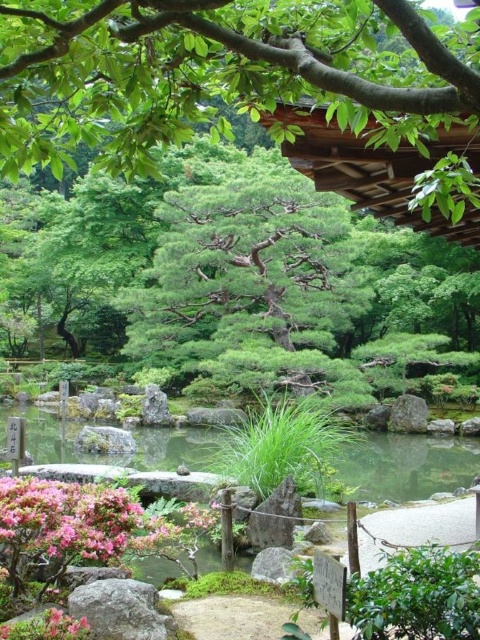
Question: Can you confirm if green stone pond at center is thinner than gray smooth rock at center-right?

Choices:
 (A) no
 (B) yes

Answer: (A)

Question: Which point is farther from the camera taking this photo?

Choices:
 (A) click(x=126, y=513)
 (B) click(x=347, y=468)

Answer: (B)

Question: Which point appears farthest from the camera in this image?

Choices:
 (A) (384, 477)
 (B) (43, 529)

Answer: (A)

Question: Does pink matte flowers at lower left lie in front of gray rough rock at lower left?

Choices:
 (A) yes
 (B) no

Answer: (B)

Question: Which is farther from the gray smooth rock at center-right?

Choices:
 (A) pink matte flowers at lower left
 (B) green stone pond at center
 (C) green leafy tree at upper center

Answer: (A)

Question: Does pink matte flowers at lower left have a lesser width compared to gray rough rock at lower left?

Choices:
 (A) no
 (B) yes

Answer: (A)